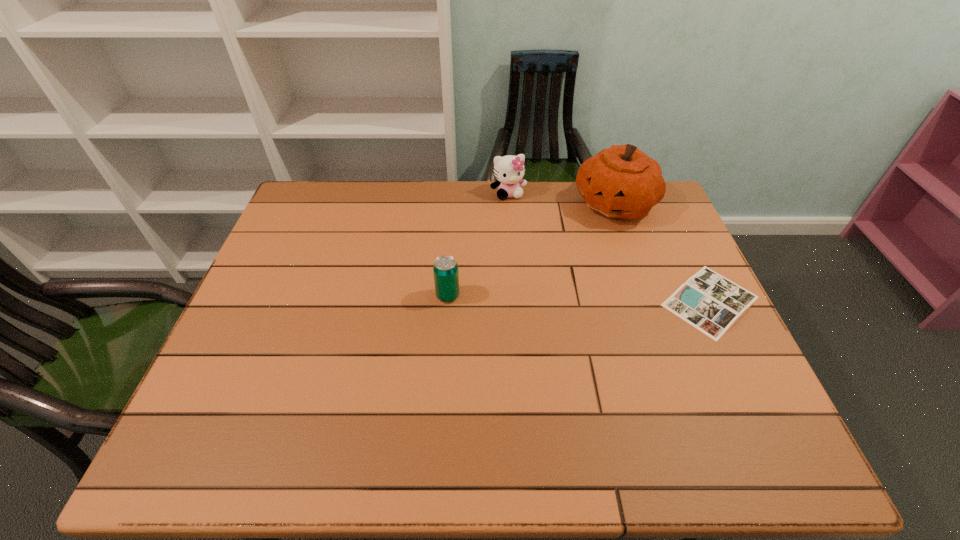
Find the location of a particular element. The height and width of the screenshot is (540, 960). vacant space that is in between the third object from right to left and the book is located at coordinates (610, 247).

Where is `free spot between the beer can and the tallest object`? This screenshot has height=540, width=960. free spot between the beer can and the tallest object is located at coordinates coord(531,249).

Identify the location of free space between the third object from right to left and the book. This screenshot has width=960, height=540. (610, 247).

The image size is (960, 540). In order to click on free space between the shortest object and the beer can in this screenshot , I will do `click(579, 298)`.

In order to click on free space between the second object from left to right and the leftmost object in this screenshot , I will do `click(478, 245)`.

Identify which object is the second nearest to the third shortest object. Please provide its 2D coordinates. Your answer should be formatted as a tuple, i.e. [(x, y)], where the tuple contains the x and y coordinates of a point satisfying the conditions above.

[(445, 269)]

The image size is (960, 540). In order to click on object that is the third closest to the book in this screenshot , I will do `click(445, 269)`.

Where is `free space that satisfies the following two spatial constraints: 1. on the front side of the third tallest object; 2. on the left side of the book`? free space that satisfies the following two spatial constraints: 1. on the front side of the third tallest object; 2. on the left side of the book is located at coordinates (447, 301).